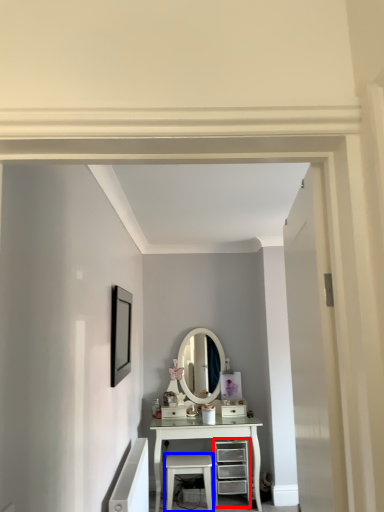
Question: Which of the following is the farthest to the observer, chest of drawers (highlighted by a red box) or stool (highlighted by a blue box)?

Choices:
 (A) chest of drawers
 (B) stool

Answer: (A)